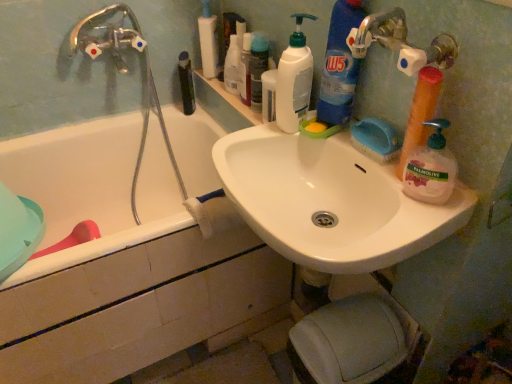
Where is `free space to the left of green matte bottle at upper center`? The width and height of the screenshot is (512, 384). free space to the left of green matte bottle at upper center is located at coordinates (154, 111).